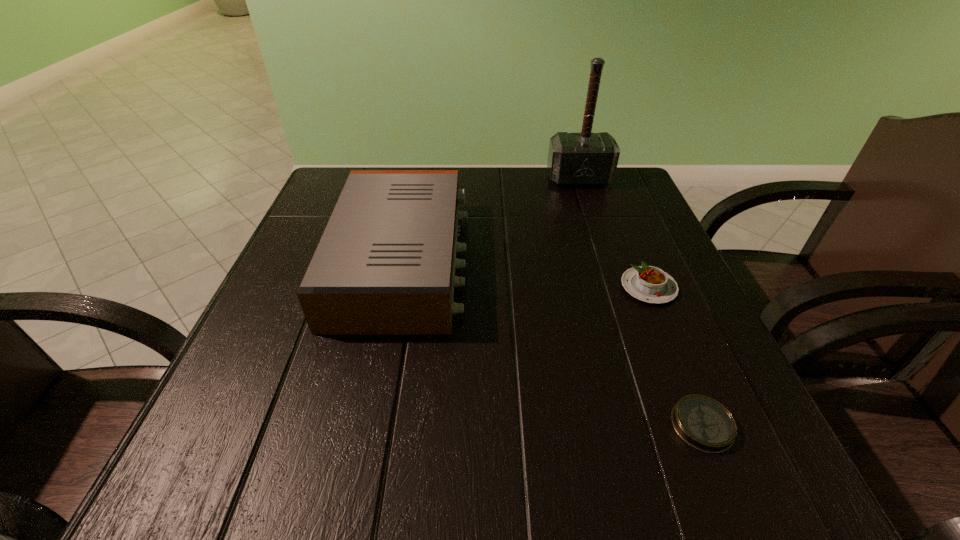
Identify the location of free space located on the left of the shortest object. This screenshot has width=960, height=540. (518, 425).

What are the coordinates of `hammer that is at the far edge` in the screenshot? It's located at (574, 159).

This screenshot has width=960, height=540. Find the location of `radio receiver that is at the far edge`. radio receiver that is at the far edge is located at coordinates (385, 264).

This screenshot has width=960, height=540. I want to click on object that is at the near edge, so click(703, 423).

Identify the location of object located at the left edge. pyautogui.click(x=385, y=264).

This screenshot has width=960, height=540. I want to click on hammer that is at the right edge, so click(574, 159).

Image resolution: width=960 pixels, height=540 pixels. I want to click on pudding at the right edge, so click(x=650, y=284).

I want to click on compass that is at the right edge, so click(x=703, y=423).

Image resolution: width=960 pixels, height=540 pixels. I want to click on object located at the far left corner, so click(x=385, y=264).

At what (x,y) coordinates should I click in order to perform the action: click on object present at the far right corner. Please return your answer as a coordinate pair (x, y). Looking at the image, I should click on tap(574, 159).